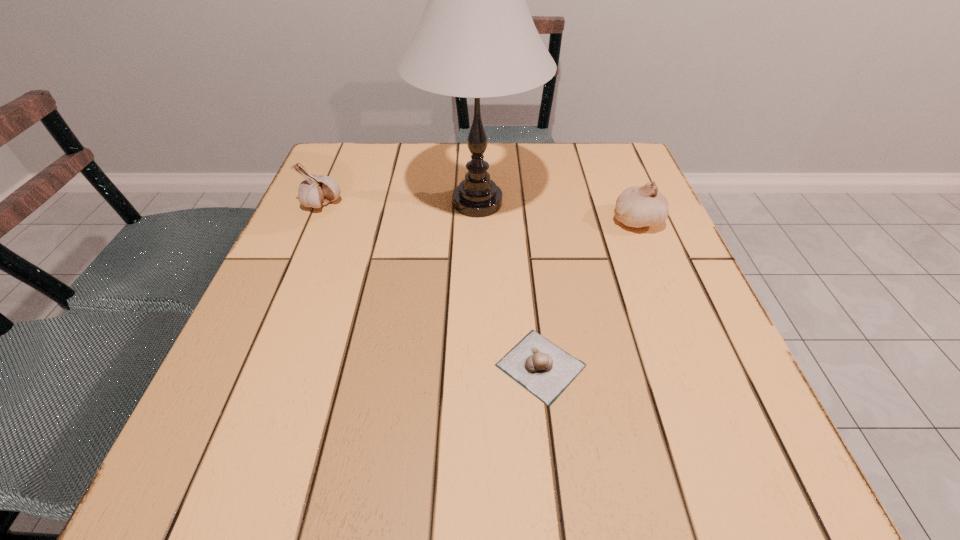
Locate an element on the screen. This screenshot has height=540, width=960. free space at the near right corner of the desktop is located at coordinates (698, 461).

Find the location of `vacant space in between the rightmost object and the shortest object`. vacant space in between the rightmost object and the shortest object is located at coordinates (588, 293).

Image resolution: width=960 pixels, height=540 pixels. What are the coordinates of `free area in between the tallest object and the rightmost garlic` in the screenshot? It's located at (557, 212).

Where is `vacant area between the rightmost object and the second garlic from left to right`? The height and width of the screenshot is (540, 960). vacant area between the rightmost object and the second garlic from left to right is located at coordinates (588, 293).

You are a GUI agent. You are given a task and a screenshot of the screen. Output one action in this format:
    pyautogui.click(x=<x>, y=<y>)
    Task: Click on the free space between the rightmost garlic and the lamp
    
    Given the screenshot: What is the action you would take?
    pyautogui.click(x=557, y=212)

At what (x,y) coordinates should I click in order to perform the action: click on vacant region between the rightmost garlic and the shortest garlic. Please return your answer as a coordinate pair (x, y). Looking at the image, I should click on (588, 293).

Where is `vacant area that lies between the rightmost object and the lamp`? The height and width of the screenshot is (540, 960). vacant area that lies between the rightmost object and the lamp is located at coordinates pos(557,212).

You are a GUI agent. You are given a task and a screenshot of the screen. Output one action in this format:
    pyautogui.click(x=<x>, y=<y>)
    Task: Click on the free space between the rightmost garlic and the second garlic from right to left
    This screenshot has width=960, height=540.
    Given the screenshot: What is the action you would take?
    pyautogui.click(x=588, y=293)

Find the location of a particular element. Image resolution: width=960 pixels, height=540 pixels. empty location between the second garlic from right to left and the lamp is located at coordinates (509, 284).

Find the location of a particular element. The height and width of the screenshot is (540, 960). free space between the tallest object and the leftmost object is located at coordinates (400, 203).